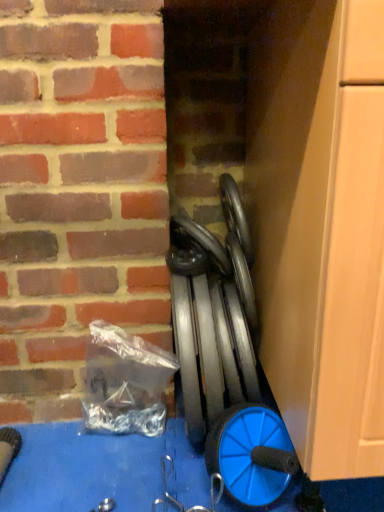
The image size is (384, 512). Identify the location of blue plastic wheel at lower right. (251, 454).

Locate an element on the screen. blue plastic wheel at lower right is located at coordinates (251, 454).

Is metallic gray weights at center positioned far away from black rubber car tire at center?

No, metallic gray weights at center is in close proximity to black rubber car tire at center.

From the image's perspective, is metallic gray weights at center located beneath black rubber car tire at center?

Correct, metallic gray weights at center appears lower than black rubber car tire at center in the image.

At what (x,y) coordinates should I click in order to perform the action: click on car tire behind the metallic gray weights at center. Please return your answer as a coordinate pair (x, y). Looking at the image, I should click on (196, 250).

Can you confirm if black rubber car tire at center is taller than blue plastic wheel at lower right?

No.

Is black rubber car tire at center directly adjacent to blue plastic wheel at lower right?

No, black rubber car tire at center is not in contact with blue plastic wheel at lower right.

Can you confirm if black rubber car tire at center is positioned to the left of blue plastic wheel at lower right?

Correct, you'll find black rubber car tire at center to the left of blue plastic wheel at lower right.

Which is behind, point (181, 273) or point (224, 451)?

The point (181, 273) is farther from the camera.

What's the angular difference between blue plastic wheel at lower right and metallic gray weights at center's facing directions?

The angular difference between blue plastic wheel at lower right and metallic gray weights at center is 4.18 degrees.

From a real-world perspective, relative to metallic gray weights at center, is blue plastic wheel at lower right vertically above or below?

Clearly, from a real-world perspective, blue plastic wheel at lower right is below metallic gray weights at center.

Which object is wider, blue plastic wheel at lower right or metallic gray weights at center?

With larger width is metallic gray weights at center.

From a real-world perspective, which is physically below, metallic gray weights at center or blue plastic wheel at lower right?

blue plastic wheel at lower right.

Is metallic gray weights at center inside the boundaries of blue plastic wheel at lower right, or outside?

metallic gray weights at center is not enclosed by blue plastic wheel at lower right.

Considering the relative sizes of metallic gray weights at center and blue plastic wheel at lower right in the image provided, is metallic gray weights at center wider than blue plastic wheel at lower right?

Yes, metallic gray weights at center is wider than blue plastic wheel at lower right.

Does black rubber car tire at center contain metallic gray weights at center?

No, metallic gray weights at center is not surrounded by black rubber car tire at center.

Is black rubber car tire at center not near metallic gray weights at center?

They are positioned close to each other.

Based on the photo, considering the sizes of objects black rubber car tire at center and metallic gray weights at center in the image provided, who is taller, black rubber car tire at center or metallic gray weights at center?

With more height is metallic gray weights at center.

Is blue plastic wheel at lower right located outside black rubber car tire at center?

blue plastic wheel at lower right lies outside black rubber car tire at center's area.

Which of these two, blue plastic wheel at lower right or black rubber car tire at center, is smaller?

black rubber car tire at center.

Is blue plastic wheel at lower right beside black rubber car tire at center?

There is a gap between blue plastic wheel at lower right and black rubber car tire at center.

How far apart are blue plastic wheel at lower right and black rubber car tire at center?

blue plastic wheel at lower right is 13.45 inches away from black rubber car tire at center.

Locate an element on the screen. This screenshot has height=512, width=384. sport equipment in front of the black rubber car tire at center is located at coordinates (225, 356).

You are a GUI agent. You are given a task and a screenshot of the screen. Output one action in this format:
    pyautogui.click(x=<x>, y=<y>)
    Task: Click on the wheel below the black rubber car tire at center (from a real-world perspective)
    The height and width of the screenshot is (512, 384).
    Given the screenshot: What is the action you would take?
    pyautogui.click(x=251, y=454)

Estimate the real-world distances between objects in this image. Which object is closer to black rubber car tire at center, metallic gray weights at center or blue plastic wheel at lower right?

Among the two, metallic gray weights at center is located nearer to black rubber car tire at center.

Considering their positions, is metallic gray weights at center positioned closer to blue plastic wheel at lower right than black rubber car tire at center?

Based on the image, metallic gray weights at center appears to be nearer to blue plastic wheel at lower right.

Considering their positions, is blue plastic wheel at lower right positioned further to metallic gray weights at center than black rubber car tire at center?

black rubber car tire at center lies further to metallic gray weights at center than the other object.

Considering their positions, is blue plastic wheel at lower right positioned closer to black rubber car tire at center than metallic gray weights at center?

The object closer to black rubber car tire at center is metallic gray weights at center.

From the image, which object appears to be nearer to blue plastic wheel at lower right, black rubber car tire at center or metallic gray weights at center?

Based on the image, metallic gray weights at center appears to be nearer to blue plastic wheel at lower right.

When comparing their distances from metallic gray weights at center, does black rubber car tire at center or blue plastic wheel at lower right seem further?

The object further to metallic gray weights at center is black rubber car tire at center.

What are the coordinates of `sport equipment between black rubber car tire at center and blue plastic wheel at lower right in the up-down direction` in the screenshot? It's located at (225, 356).